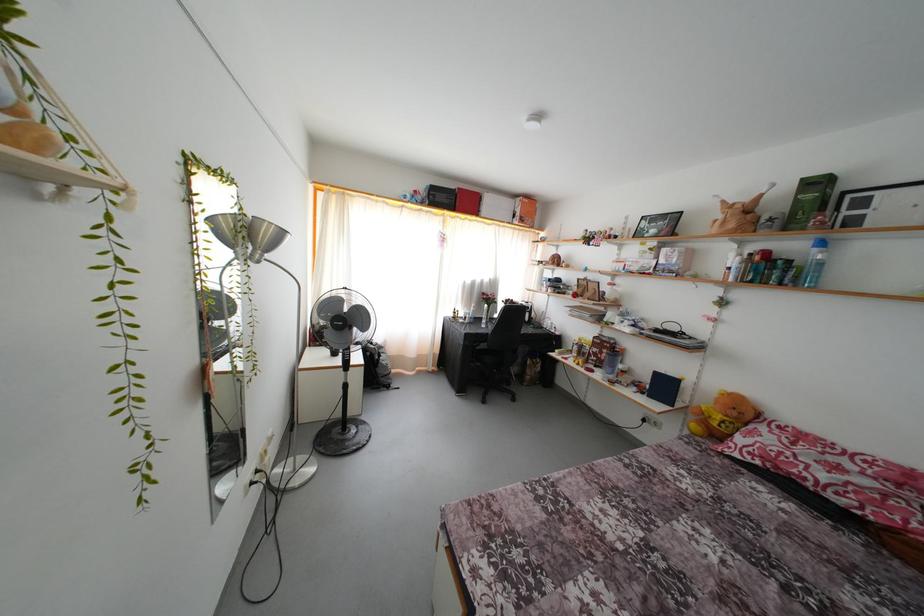
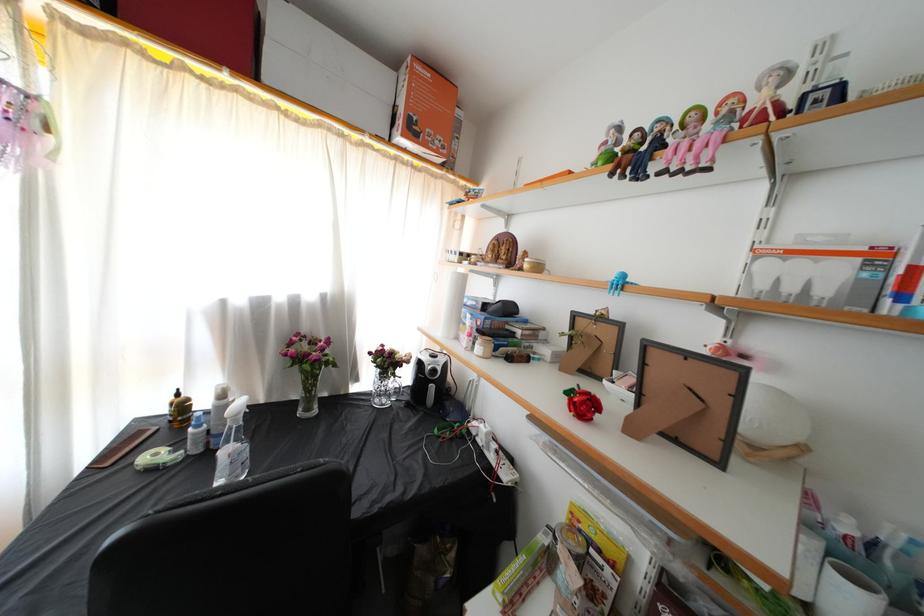
The point at (593, 245) is marked in the first image. Where is the corresponding point in the second image?

(638, 161)